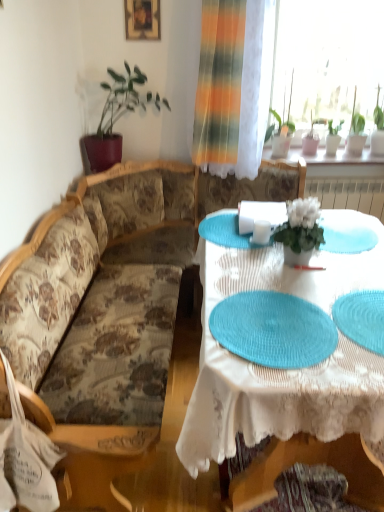
The width and height of the screenshot is (384, 512). I want to click on vacant area that lies between white matte flower pot at center, the fourth houseplant positioned from the right, and blue woven placemat at lower right, so click(331, 284).